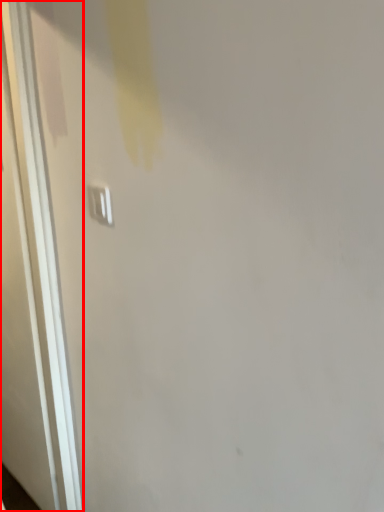
Question: From the image, what is the correct spatial relationship of door (annotated by the red box) in relation to light switch?

Choices:
 (A) left
 (B) right

Answer: (A)